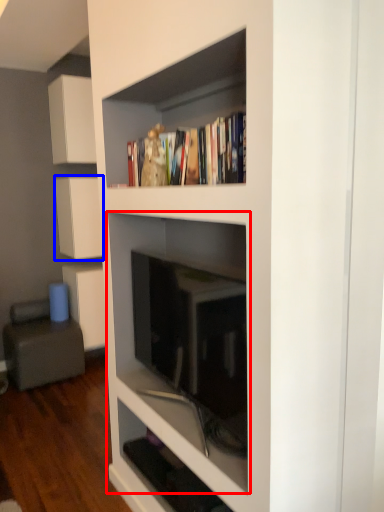
Question: Which object is further to the camera taking this photo, shelf (highlighted by a red box) or cabinetry (highlighted by a blue box)?

Choices:
 (A) shelf
 (B) cabinetry

Answer: (B)